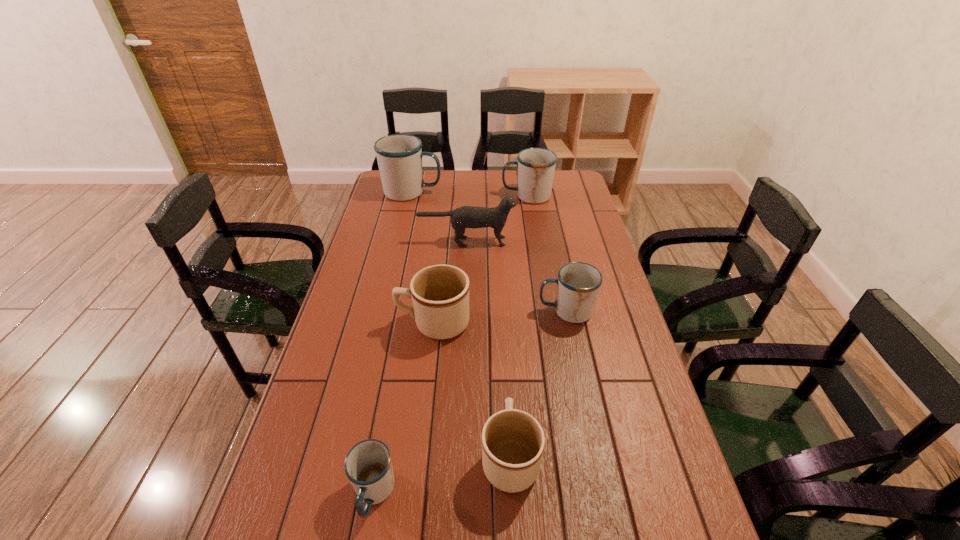
Locate which white mug is the closest to the smaller brown mug. Please provide its 2D coordinates. Your answer should be formatted as a tuple, i.e. [(x, y)], where the tuple contains the x and y coordinates of a point satisfying the conditions above.

[(368, 466)]

Identify which white mug is located as the third nearest to the shortest object. Please provide its 2D coordinates. Your answer should be formatted as a tuple, i.e. [(x, y)], where the tuple contains the x and y coordinates of a point satisfying the conditions above.

[(536, 166)]

Identify which brown mug is located as the nearest to the tallest mug. Please provide its 2D coordinates. Your answer should be formatted as a tuple, i.e. [(x, y)], where the tuple contains the x and y coordinates of a point satisfying the conditions above.

[(440, 293)]

Select which brown mug appears as the second closest to the tallest mug. Please provide its 2D coordinates. Your answer should be formatted as a tuple, i.e. [(x, y)], where the tuple contains the x and y coordinates of a point satisfying the conditions above.

[(513, 441)]

In order to click on vacant space that satisfies the following two spatial constraints: 1. on the front-facing side of the cat; 2. on the side of the nearer brown mug with the handle in this screenshot , I will do `click(458, 457)`.

The height and width of the screenshot is (540, 960). In order to click on blank area in the image that satisfies the following two spatial constraints: 1. on the side of the smaller brown mug with the handle; 2. on the front-facing side of the cat in this screenshot , I will do `click(498, 241)`.

The image size is (960, 540). I want to click on vacant point that satisfies the following two spatial constraints: 1. on the handle side of the tallest mug; 2. on the side of the nearer brown mug with the handle, so click(351, 457).

The width and height of the screenshot is (960, 540). What are the coordinates of `vacant region that satisfies the following two spatial constraints: 1. on the handle side of the tallest mug; 2. on the side of the nearer brown mug with the handle` in the screenshot? It's located at (351, 457).

Find the location of a particular element. This screenshot has width=960, height=540. free space that satisfies the following two spatial constraints: 1. on the side of the left brown mug with the handle; 2. on the handle side of the tallest mug is located at coordinates (448, 192).